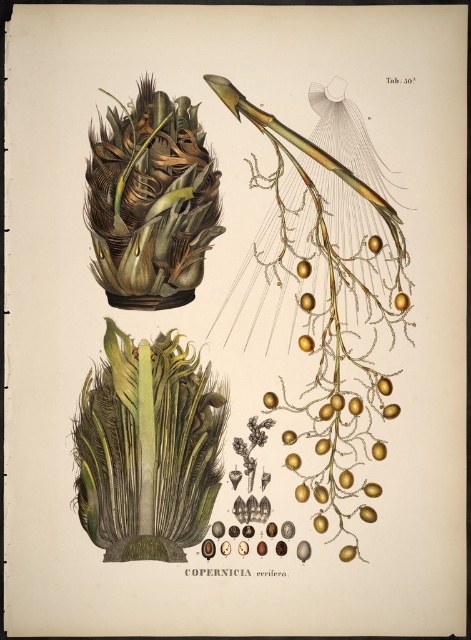
Question: Which point is closer to the camera?

Choices:
 (A) green leafy plant at center
 (B) golden glossy fruit at center-right
 (C) golden matte fruit at center-right

Answer: (A)

Question: Where is green leafy plant at center located in relation to golden glossy fruit at center-right in the image?

Choices:
 (A) right
 (B) left

Answer: (B)

Question: Which point appears closest to the camera in this image?

Choices:
 (A) (302, 273)
 (B) (381, 241)

Answer: (B)

Question: Observing the image, what is the correct spatial positioning of golden matte fruit at right in reference to golden glossy fruit at center-right?

Choices:
 (A) left
 (B) right

Answer: (B)

Question: Estimate the real-world distances between objects in this image. Which object is farther from the green leafy plant at center?

Choices:
 (A) golden glossy fruit at upper right
 (B) golden matte fruit at center-right

Answer: (A)

Question: Is green leafy plant at center bigger than golden matte fruit at right?

Choices:
 (A) no
 (B) yes

Answer: (B)